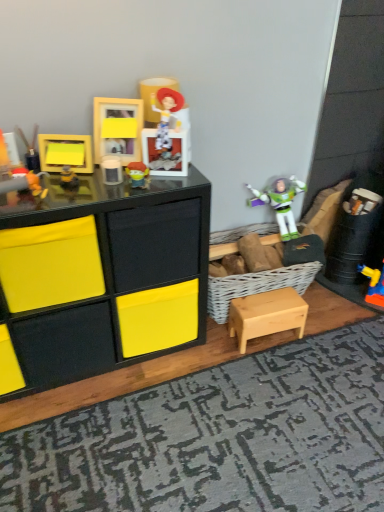
Image resolution: width=384 pixels, height=512 pixels. I want to click on free space in front of light wood table at lower right, so click(x=281, y=370).